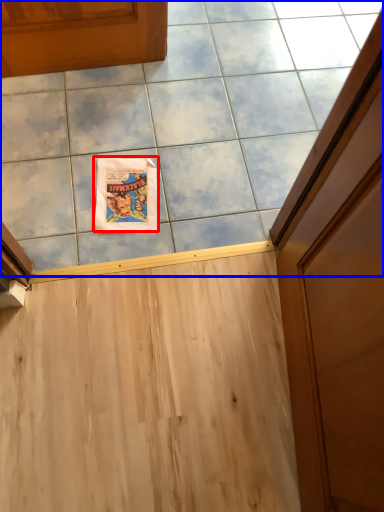
Question: Which object appears closest to the camera in this image, comic book (highlighted by a red box) or ceramic tile (highlighted by a blue box)?

Choices:
 (A) comic book
 (B) ceramic tile

Answer: (B)